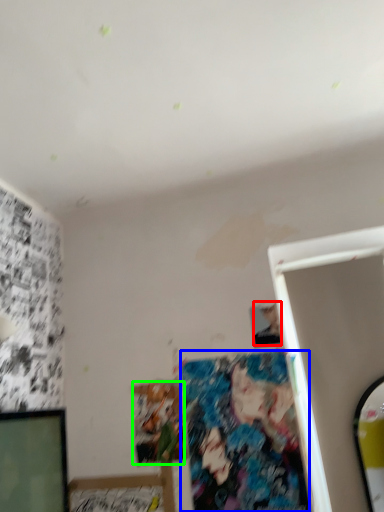
Question: Which object is the closest to the person (highlighted by a red box)? Choose among these: art (highlighted by a blue box) or art (highlighted by a green box).

Choices:
 (A) art
 (B) art

Answer: (A)